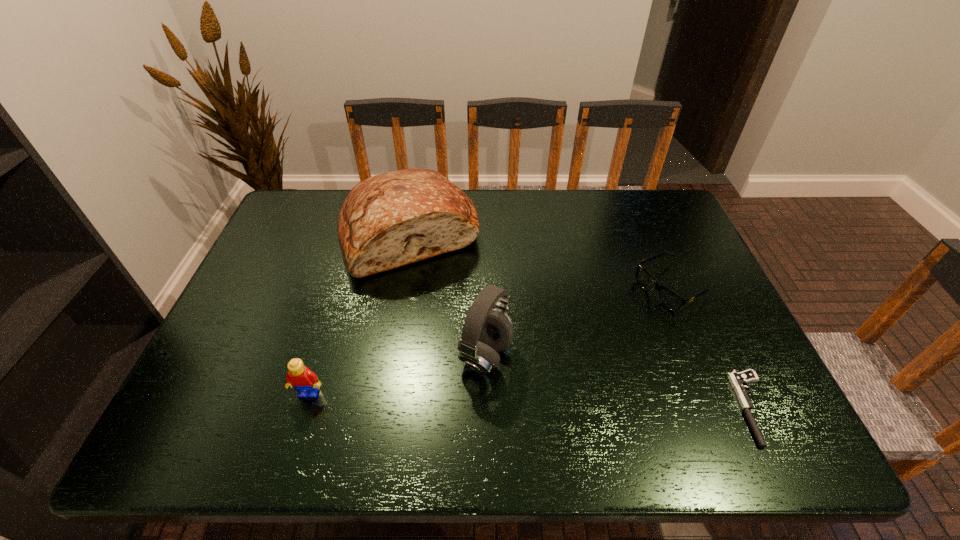
This screenshot has height=540, width=960. I want to click on free space located on the front-facing side of the fourth tallest object, so click(570, 344).

The image size is (960, 540). Identify the location of free region located 0.140m on the ear cups of the headset. (565, 401).

Locate an element on the screen. The width and height of the screenshot is (960, 540). vacant area located 0.150m on the ear cups of the headset is located at coordinates (569, 403).

Find the location of a particular element. free spot located 0.070m on the ear cups of the headset is located at coordinates (537, 386).

Find the location of a particular element. The width and height of the screenshot is (960, 540). object situated at the far edge is located at coordinates (389, 220).

Locate an element on the screen. The height and width of the screenshot is (540, 960). Lego present at the near edge is located at coordinates (299, 377).

Find the location of a particular element. pistol that is at the near edge is located at coordinates (738, 380).

Find the location of a particular element. This screenshot has height=540, width=960. headset located at the near edge is located at coordinates (485, 332).

Locate an element on the screen. pistol at the right edge is located at coordinates (738, 380).

What are the coordinates of `sunglasses situated at the right edge` in the screenshot? It's located at [x=669, y=299].